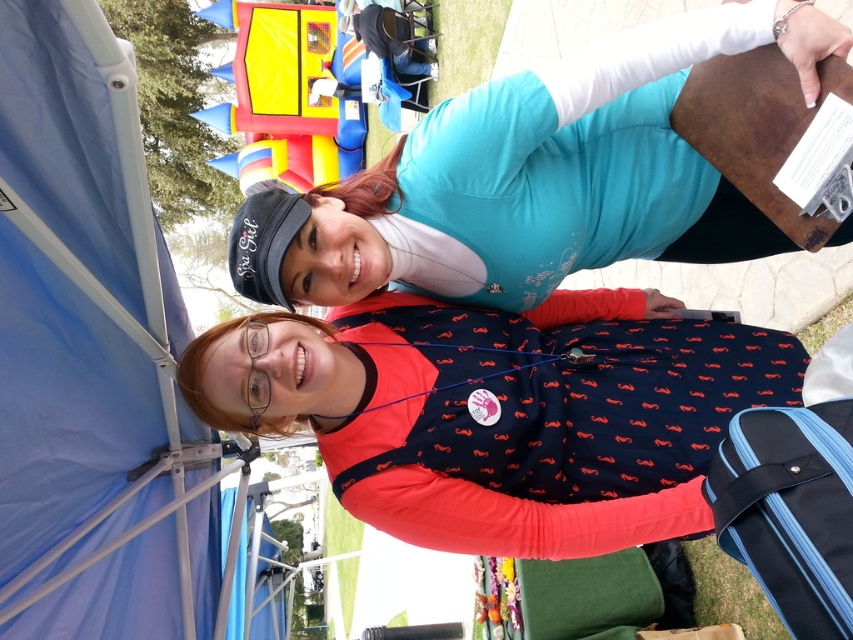
Is blue fabric canopy at upper left taller than blue fabric suitcase at lower right?

Yes, blue fabric canopy at upper left is taller than blue fabric suitcase at lower right.

Measure the distance between blue fabric canopy at upper left and camera.

blue fabric canopy at upper left is 32.61 inches from camera.

Where is `blue fabric canopy at upper left`? blue fabric canopy at upper left is located at coordinates (90, 353).

What do you see at coordinates (502, 412) in the screenshot?
I see `navy blue fabric with orange mustache pattern at center` at bounding box center [502, 412].

Is point (419, 483) positioned behind point (430, 161)?

That is True.

Identify the location of navy blue fabric with orange mustache pattern at center. This screenshot has height=640, width=853. (502, 412).

At what (x,y) coordinates should I click in order to perform the action: click on navy blue fabric with orange mustache pattern at center. Please return your answer as a coordinate pair (x, y). The width and height of the screenshot is (853, 640). Looking at the image, I should click on (502, 412).

Can you confirm if blue fabric canopy at upper left is positioned below teal matte shirt at upper center?

Indeed, blue fabric canopy at upper left is positioned under teal matte shirt at upper center.

Between point (33, 141) and point (438, 140), which one is positioned behind?

Point (438, 140)

Who is more distant from viewer, (99, 96) or (608, 195)?

Positioned behind is point (608, 195).

The width and height of the screenshot is (853, 640). Identify the location of blue fabric canopy at upper left. (90, 353).